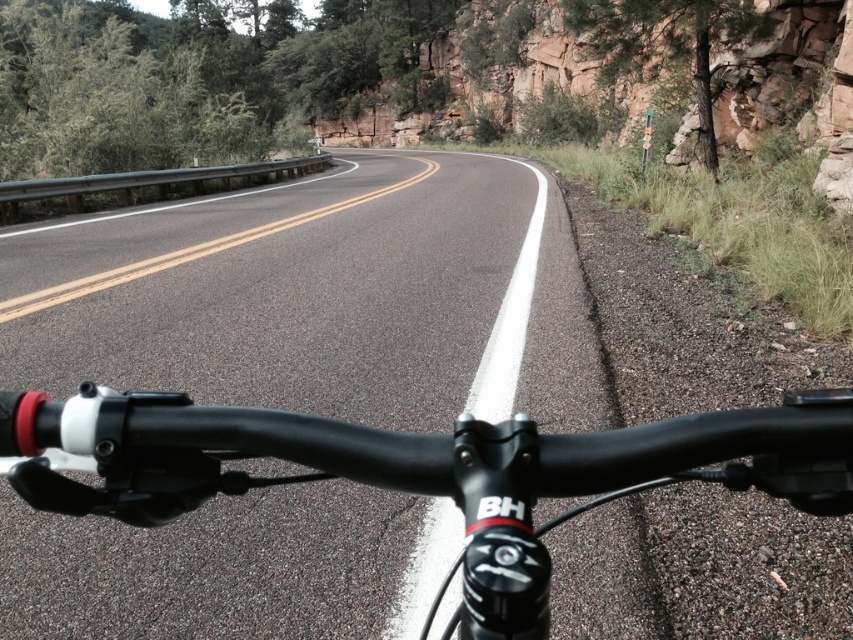
Which of these two, black asphalt road at center or black matte bicycle handlebars at center, stands shorter?

black matte bicycle handlebars at center is shorter.

Can you confirm if black asphalt road at center is smaller than black matte bicycle handlebars at center?

No, black asphalt road at center is not smaller than black matte bicycle handlebars at center.

Which is behind, point (393, 426) or point (532, 481)?

Positioned behind is point (393, 426).

Image resolution: width=853 pixels, height=640 pixels. I want to click on black asphalt road at center, so click(x=320, y=298).